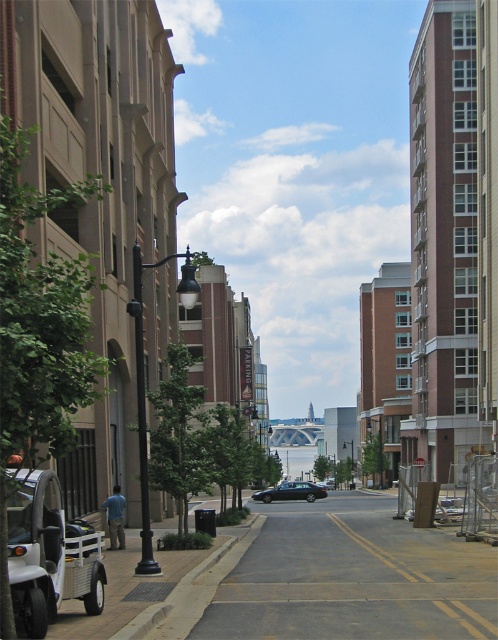
You are driving a car and need to cross the gray asphalt road at center. There is a shiny black sedan at center blocking your path. Can you pass through the road without going off the road?

The gray asphalt road at center is thinner than the shiny black sedan at center, so the road is narrower than the car. Therefore, you cannot pass through the road without going off the road.

You are standing at the starting point of the street and want to walk to the bridge in the distance. There are two points marked on the left side of the street at coordinates point (334, 532) and point (292, 481). Which point will you reach first as you walk towards the bridge?

Point (334, 532) is in front of point (292, 481), so you will reach point (334, 532) first as you walk towards the bridge.